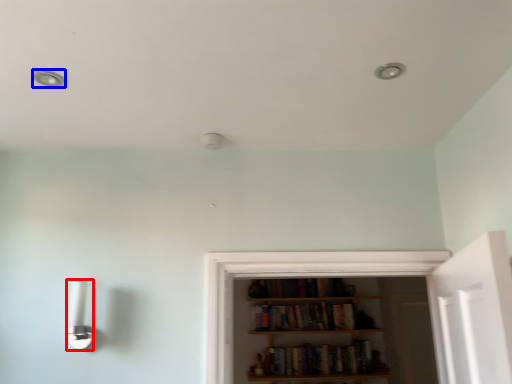
Question: Which object is closer to the camera taking this photo, light fixture (highlighted by a red box) or dot (highlighted by a blue box)?

Choices:
 (A) light fixture
 (B) dot

Answer: (B)